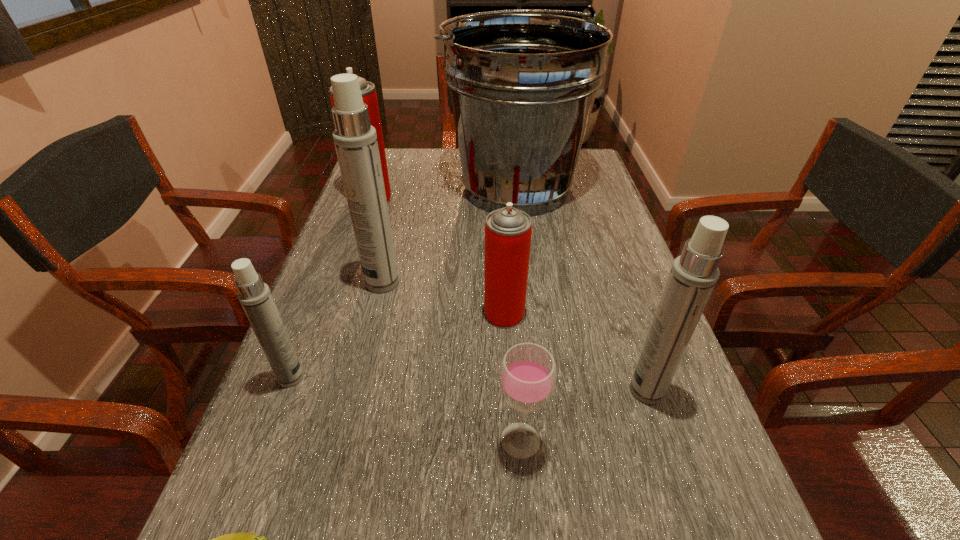
In order to click on free space between the rightmost white aerosol can and the leftmost white aerosol can in this screenshot , I will do `click(469, 384)`.

Image resolution: width=960 pixels, height=540 pixels. Find the location of `object that is the closest to the seventh farthest object`. object that is the closest to the seventh farthest object is located at coordinates (693, 275).

Select which object is the fifth closest to the seventh farthest object. Please provide its 2D coordinates. Your answer should be formatted as a tuple, i.e. [(x, y)], where the tuple contains the x and y coordinates of a point satisfying the conditions above.

[(355, 140)]

Find the location of a particular element. the closest aerosol can to the rightmost aerosol can is located at coordinates (508, 230).

Where is `aerosol can that is the third closest to the smallest white aerosol can`? aerosol can that is the third closest to the smallest white aerosol can is located at coordinates (369, 95).

In order to click on white aerosol can object that ranks as the closest to the farthest white aerosol can in this screenshot , I will do `click(255, 297)`.

Identify which white aerosol can is the closest to the leftmost white aerosol can. Please provide its 2D coordinates. Your answer should be formatted as a tuple, i.e. [(x, y)], where the tuple contains the x and y coordinates of a point satisfying the conditions above.

[(355, 140)]

I want to click on free location that satisfies the following two spatial constraints: 1. on the front side of the bucket; 2. on the left side of the second biggest white aerosol can, so click(540, 390).

Locate an element on the screen. free location that satisfies the following two spatial constraints: 1. on the front side of the second white aerosol can from right to left; 2. on the right side of the seventh tallest object is located at coordinates (343, 440).

Locate an element on the screen. blank space that satisfies the following two spatial constraints: 1. on the back side of the left red aerosol can; 2. on the right side of the bucket is located at coordinates (375, 189).